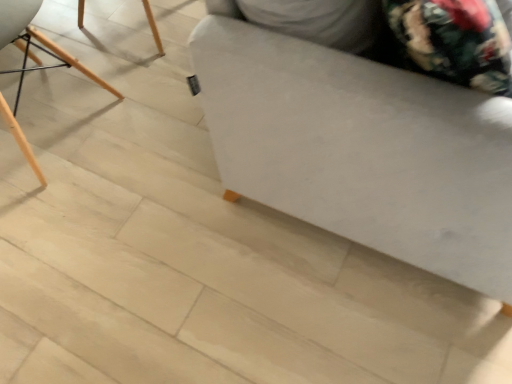
Question: Does point (3, 44) appear closer or farther from the camera than point (369, 77)?

Choices:
 (A) farther
 (B) closer

Answer: (A)

Question: Is wooden chair at left taller or shorter than white fabric ottoman at center?

Choices:
 (A) short
 (B) tall

Answer: (A)

Question: Is wooden chair at left wider or thinner than white fabric ottoman at center?

Choices:
 (A) wide
 (B) thin

Answer: (B)

Question: Do you think white fabric ottoman at center is within wooden chair at left, or outside of it?

Choices:
 (A) inside
 (B) outside

Answer: (B)

Question: Looking at the image, does white fabric ottoman at center seem bigger or smaller compared to wooden chair at left?

Choices:
 (A) big
 (B) small

Answer: (A)

Question: Does point (254, 29) appear closer or farther from the camera than point (11, 130)?

Choices:
 (A) closer
 (B) farther

Answer: (A)

Question: From a real-world perspective, is white fabric ottoman at center positioned above or below wooden chair at left?

Choices:
 (A) below
 (B) above

Answer: (B)